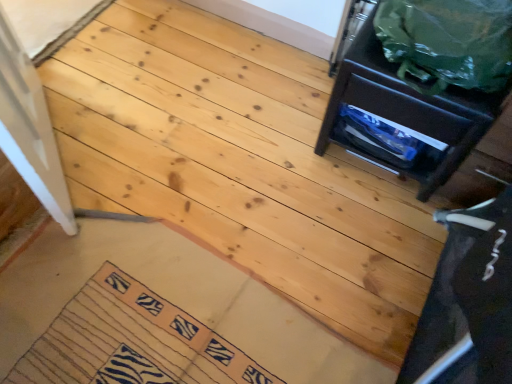
Question: From a real-world perspective, is green plastic bag at upper right on top of zebra-patterned fabric mat at lower left?

Choices:
 (A) yes
 (B) no

Answer: (A)

Question: Would you say zebra-patterned fabric mat at lower left is part of green plastic bag at upper right's contents?

Choices:
 (A) yes
 (B) no

Answer: (B)

Question: Does green plastic bag at upper right lie behind zebra-patterned fabric mat at lower left?

Choices:
 (A) no
 (B) yes

Answer: (A)

Question: Is green plastic bag at upper right facing away from zebra-patterned fabric mat at lower left?

Choices:
 (A) yes
 (B) no

Answer: (B)

Question: From the image's perspective, does green plastic bag at upper right appear lower than zebra-patterned fabric mat at lower left?

Choices:
 (A) no
 (B) yes

Answer: (A)

Question: Considering the positions of matte black drawer at upper right and zebra-patterned fabric mat at lower left in the image, is matte black drawer at upper right bigger or smaller than zebra-patterned fabric mat at lower left?

Choices:
 (A) big
 (B) small

Answer: (A)

Question: From a real-world perspective, is matte black drawer at upper right physically located above or below zebra-patterned fabric mat at lower left?

Choices:
 (A) above
 (B) below

Answer: (A)

Question: In the image, is matte black drawer at upper right positioned in front of or behind zebra-patterned fabric mat at lower left?

Choices:
 (A) behind
 (B) front

Answer: (A)

Question: From the image's perspective, is matte black drawer at upper right located above or below zebra-patterned fabric mat at lower left?

Choices:
 (A) below
 (B) above

Answer: (B)

Question: In terms of height, does zebra-patterned fabric mat at lower left look taller or shorter compared to matte black drawer at upper right?

Choices:
 (A) short
 (B) tall

Answer: (A)

Question: Do you think zebra-patterned fabric mat at lower left is within matte black drawer at upper right, or outside of it?

Choices:
 (A) inside
 (B) outside

Answer: (B)

Question: Is point (27, 380) positioned closer to the camera than point (373, 105)?

Choices:
 (A) closer
 (B) farther

Answer: (A)

Question: From the image's perspective, is zebra-patterned fabric mat at lower left above or below matte black drawer at upper right?

Choices:
 (A) below
 (B) above

Answer: (A)

Question: In terms of width, does green plastic bag at upper right look wider or thinner when compared to matte black drawer at upper right?

Choices:
 (A) wide
 (B) thin

Answer: (B)

Question: Is green plastic bag at upper right situated inside matte black drawer at upper right or outside?

Choices:
 (A) inside
 (B) outside

Answer: (B)